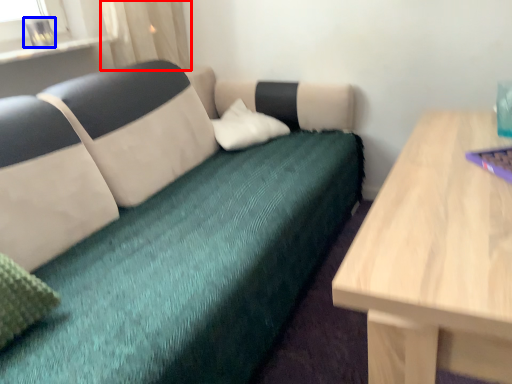
Question: Which point is closer to the camera, curtain (highlighted by a red box) or glass vase (highlighted by a blue box)?

Choices:
 (A) curtain
 (B) glass vase

Answer: (B)